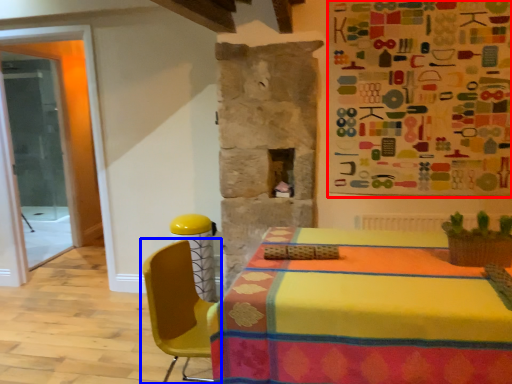
Question: Among these objects, which one is farthest to the camera, bulletin board (highlighted by a red box) or chair (highlighted by a blue box)?

Choices:
 (A) bulletin board
 (B) chair

Answer: (A)